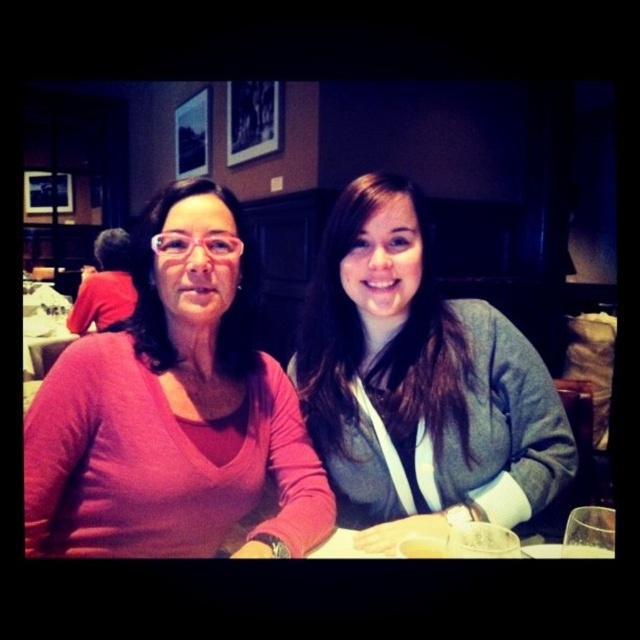
Question: Which of the following is the farthest from the observer?

Choices:
 (A) red shirt at left
 (B) gray fleece sweater at center

Answer: (A)

Question: Is gray fleece sweater at center positioned in front of red shirt at left?

Choices:
 (A) no
 (B) yes

Answer: (B)

Question: Among these points, which one is nearest to the camera?

Choices:
 (A) (120, 244)
 (B) (68, 515)
 (C) (372, 374)

Answer: (B)

Question: Which object is the closest to the matte pink sweater at left?

Choices:
 (A) red shirt at left
 (B) gray fleece sweater at center

Answer: (B)

Question: Can you confirm if gray fleece sweater at center is bigger than red shirt at left?

Choices:
 (A) yes
 (B) no

Answer: (B)

Question: Is matte pink sweater at left further to the viewer compared to red shirt at left?

Choices:
 (A) yes
 (B) no

Answer: (B)